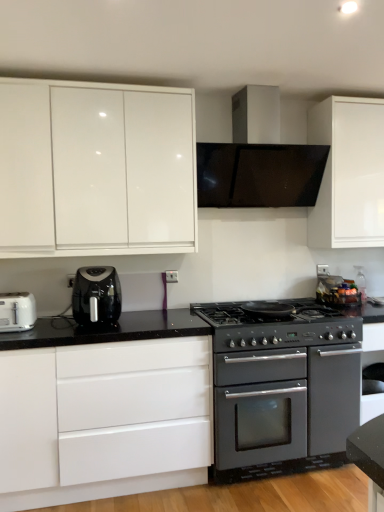
At what (x,y) coordinates should I click in order to perform the action: click on free point above satin silver range hood at upper center (from a real-world perspective). Please return your answer as a coordinate pair (x, y). This screenshot has height=512, width=384. Looking at the image, I should click on (238, 83).